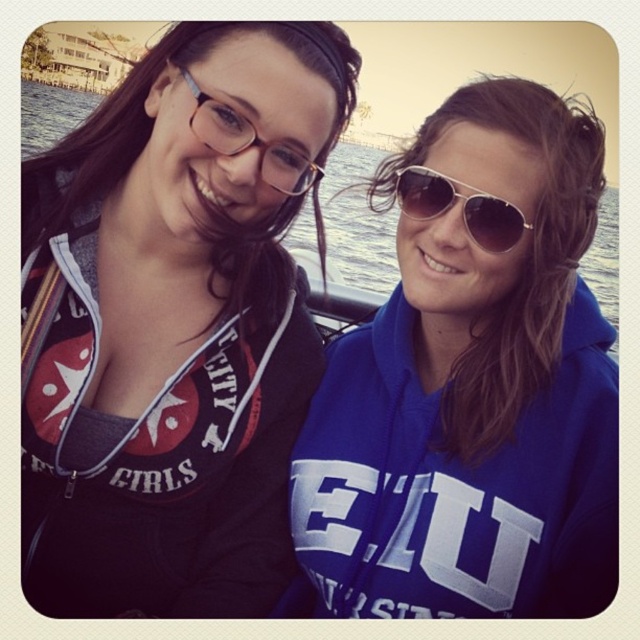
Question: Which of the following is the farthest from the observer?

Choices:
 (A) blue matte hoodie at right
 (B) matte black hoodie at left
 (C) matte plastic glasses at upper left
 (D) blue water at center

Answer: (D)

Question: Does blue matte hoodie at right appear under blue water at center?

Choices:
 (A) yes
 (B) no

Answer: (A)

Question: Which of the following is the closest to the observer?

Choices:
 (A) sunglasses at center
 (B) blue matte hoodie at right
 (C) matte plastic glasses at upper left
 (D) matte black hoodie at left

Answer: (C)

Question: Which of the following is the farthest from the observer?

Choices:
 (A) (422, 150)
 (B) (529, 227)
 (C) (211, 45)

Answer: (A)

Question: Does matte black hoodie at left appear over blue water at center?

Choices:
 (A) yes
 (B) no

Answer: (B)

Question: Can you confirm if matte black hoodie at left is positioned to the right of blue water at center?

Choices:
 (A) yes
 (B) no

Answer: (A)